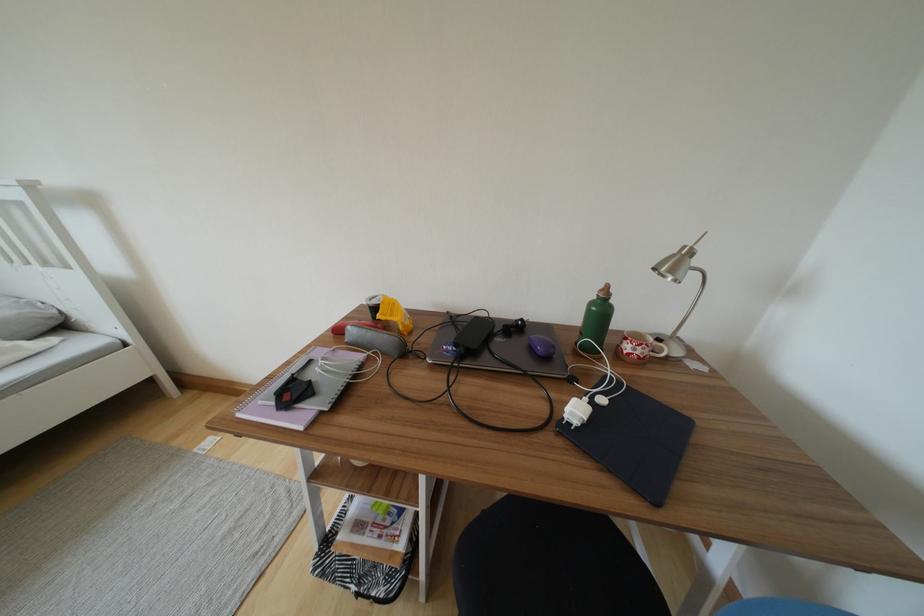
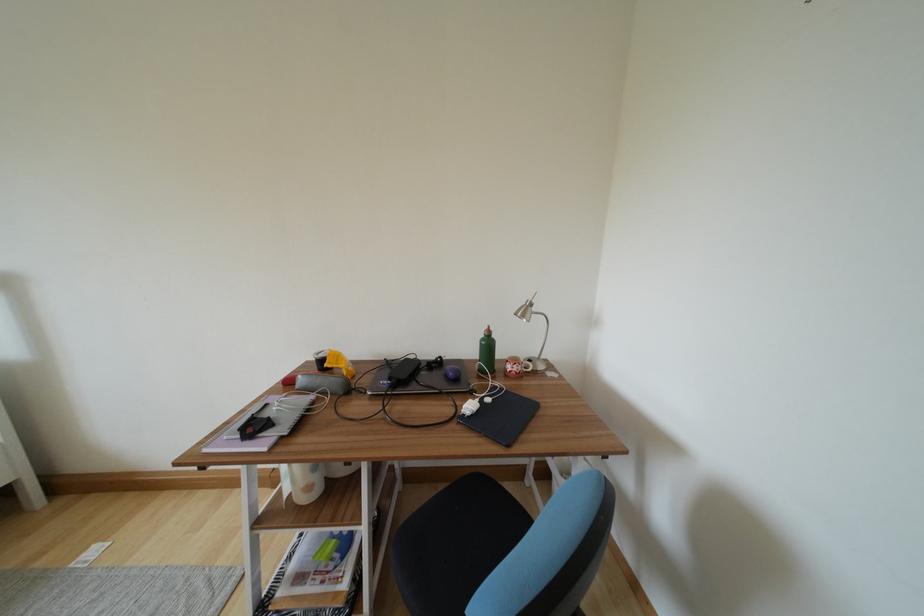
Find the pixel in the second image that matches [677,275] in the first image.

(528, 320)